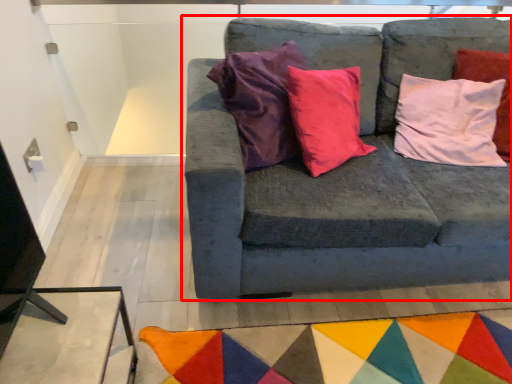
Question: From the image's perspective, considering the relative positions of studio couch (annotated by the red box) and mat in the image provided, where is studio couch (annotated by the red box) located with respect to the staircase?

Choices:
 (A) below
 (B) above

Answer: (B)